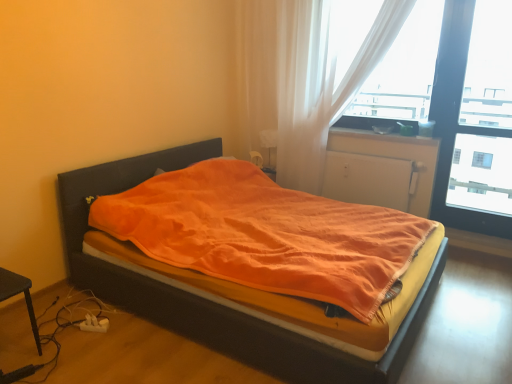
Question: Is white plastic charger at lower left positioned with its back to white matte radiator at center?

Choices:
 (A) no
 (B) yes

Answer: (A)

Question: From a real-world perspective, does white plastic charger at lower left stand above white matte radiator at center?

Choices:
 (A) no
 (B) yes

Answer: (A)

Question: Considering the relative sizes of white plastic charger at lower left and white matte radiator at center in the image provided, is white plastic charger at lower left bigger than white matte radiator at center?

Choices:
 (A) no
 (B) yes

Answer: (A)

Question: From the image's perspective, is white plastic charger at lower left on white matte radiator at center?

Choices:
 (A) yes
 (B) no

Answer: (B)

Question: Can you confirm if white plastic charger at lower left is wider than white matte radiator at center?

Choices:
 (A) yes
 (B) no

Answer: (B)

Question: From the image's perspective, is white matte radiator at center located above or below matte plastic window sill at upper right?

Choices:
 (A) below
 (B) above

Answer: (A)

Question: Is white matte radiator at center bigger or smaller than matte plastic window sill at upper right?

Choices:
 (A) small
 (B) big

Answer: (B)

Question: From a real-world perspective, relative to matte plastic window sill at upper right, is white matte radiator at center vertically above or below?

Choices:
 (A) below
 (B) above

Answer: (A)

Question: Based on their positions, is white matte radiator at center located to the left or right of matte plastic window sill at upper right?

Choices:
 (A) left
 (B) right

Answer: (A)

Question: Is point (175, 317) closer or farther from the camera than point (313, 112)?

Choices:
 (A) closer
 (B) farther

Answer: (A)

Question: In terms of height, does orange fabric bed at center look taller or shorter compared to translucent white curtain at upper right, placed as the 1th curtain when sorted from left to right?

Choices:
 (A) short
 (B) tall

Answer: (A)

Question: Do you think orange fabric bed at center is within translucent white curtain at upper right, marked as the 2th curtain in a right-to-left arrangement, or outside of it?

Choices:
 (A) outside
 (B) inside

Answer: (A)

Question: Would you say orange fabric bed at center is to the left or to the right of translucent white curtain at upper right, marked as the 2th curtain in a right-to-left arrangement, in the picture?

Choices:
 (A) left
 (B) right

Answer: (A)

Question: Considering the relative positions of white matte radiator at center and orange fabric bed at center in the image provided, is white matte radiator at center to the left or to the right of orange fabric bed at center?

Choices:
 (A) left
 (B) right

Answer: (B)

Question: In terms of height, does white matte radiator at center look taller or shorter compared to orange fabric bed at center?

Choices:
 (A) tall
 (B) short

Answer: (B)